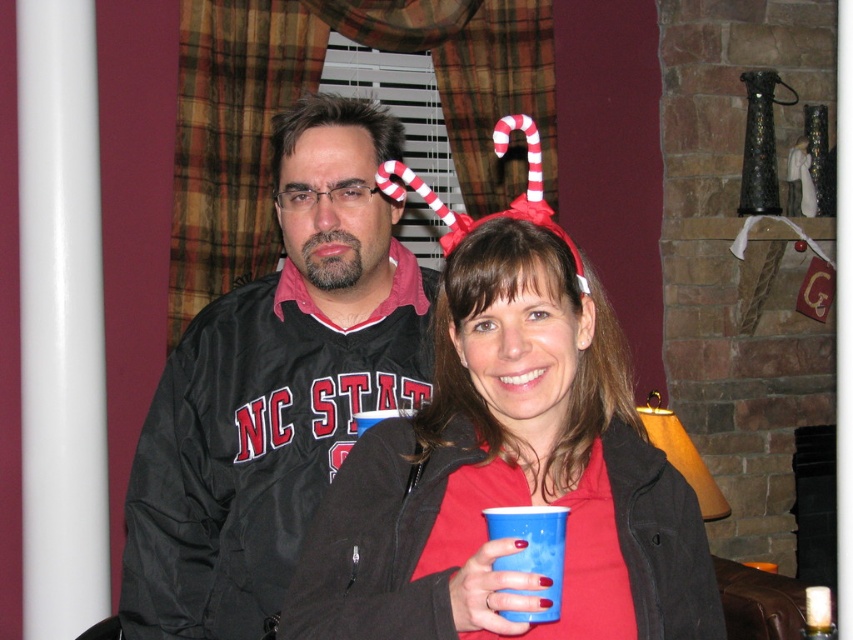
Question: Is red striped candy cane at upper center smaller than white striped fabric candy cane at upper center?

Choices:
 (A) no
 (B) yes

Answer: (A)

Question: Does blue plastic cup at lower center have a greater width compared to white striped fabric candy cane at upper center?

Choices:
 (A) no
 (B) yes

Answer: (A)

Question: Does black matte jacket at center have a larger size compared to red striped candy cane at upper center?

Choices:
 (A) no
 (B) yes

Answer: (B)

Question: Among these points, which one is nearest to the camera?

Choices:
 (A) [418, 460]
 (B) [328, 291]
 (C) [444, 246]

Answer: (A)

Question: Which is farther from the blue plastic cup at lower center?

Choices:
 (A) black matte jacket at center
 (B) white striped fabric candy cane at upper center
 (C) matte plastic cup at center

Answer: (A)

Question: Considering the real-world distances, which object is closest to the blue plastic cup at lower center?

Choices:
 (A) black matte jacket at center
 (B) white striped fabric candy cane at upper center
 (C) red striped candy cane at upper center
 (D) matte plastic cup at center

Answer: (D)